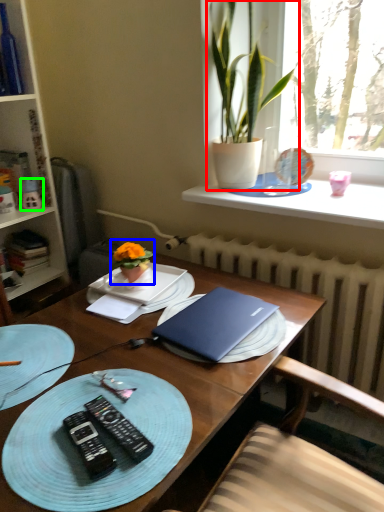
Question: Estimate the real-world distances between objects in this image. Which object is farther from houseplant (highlighted by a red box), houseplant (highlighted by a blue box) or toy (highlighted by a green box)?

Choices:
 (A) houseplant
 (B) toy

Answer: (B)